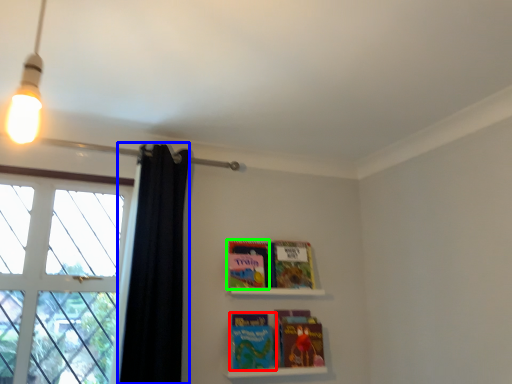
Question: Which object is positioned closest to paperback book (highlighted by a red box)? Select from shower curtain (highlighted by a blue box) and paperback book (highlighted by a green box).

Choices:
 (A) shower curtain
 (B) paperback book

Answer: (B)